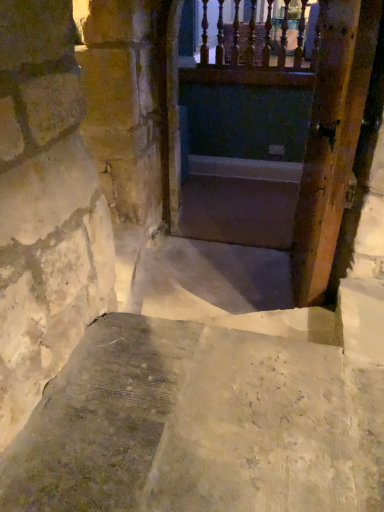
Question: Is smooth concrete stairs at center located within wooden railing at upper center?

Choices:
 (A) yes
 (B) no

Answer: (B)

Question: Is wooden railing at upper center with smooth concrete stairs at center?

Choices:
 (A) yes
 (B) no

Answer: (B)

Question: Can you confirm if wooden railing at upper center is positioned to the left of smooth concrete stairs at center?

Choices:
 (A) yes
 (B) no

Answer: (A)

Question: Considering the relative sizes of wooden railing at upper center and smooth concrete stairs at center in the image provided, is wooden railing at upper center smaller than smooth concrete stairs at center?

Choices:
 (A) yes
 (B) no

Answer: (B)

Question: Is wooden railing at upper center wider than smooth concrete stairs at center?

Choices:
 (A) no
 (B) yes

Answer: (A)

Question: From a real-world perspective, is wooden railing at upper center under smooth concrete stairs at center?

Choices:
 (A) yes
 (B) no

Answer: (B)

Question: Is wooden door at right surrounding wooden railing at upper center?

Choices:
 (A) no
 (B) yes

Answer: (A)

Question: Can you confirm if wooden door at right is thinner than wooden railing at upper center?

Choices:
 (A) yes
 (B) no

Answer: (A)

Question: Is the position of wooden door at right more distant than that of wooden railing at upper center?

Choices:
 (A) yes
 (B) no

Answer: (B)

Question: Considering the relative sizes of wooden door at right and wooden railing at upper center in the image provided, is wooden door at right taller than wooden railing at upper center?

Choices:
 (A) yes
 (B) no

Answer: (A)

Question: Could you tell me if wooden door at right is turned towards wooden railing at upper center?

Choices:
 (A) no
 (B) yes

Answer: (A)

Question: Does wooden door at right have a lesser height compared to wooden railing at upper center?

Choices:
 (A) yes
 (B) no

Answer: (B)

Question: Is smooth concrete stairs at center positioned beyond the bounds of wooden door at right?

Choices:
 (A) yes
 (B) no

Answer: (A)